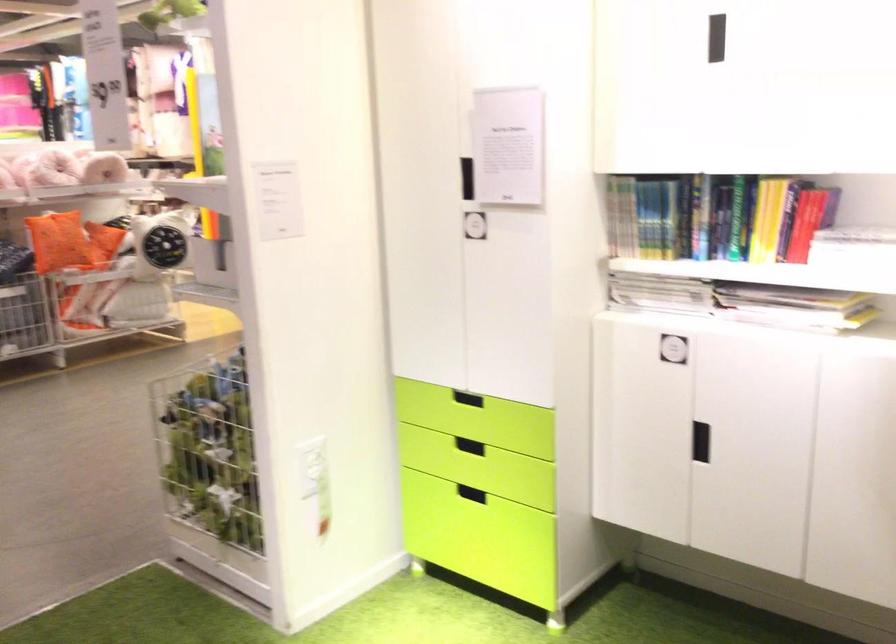
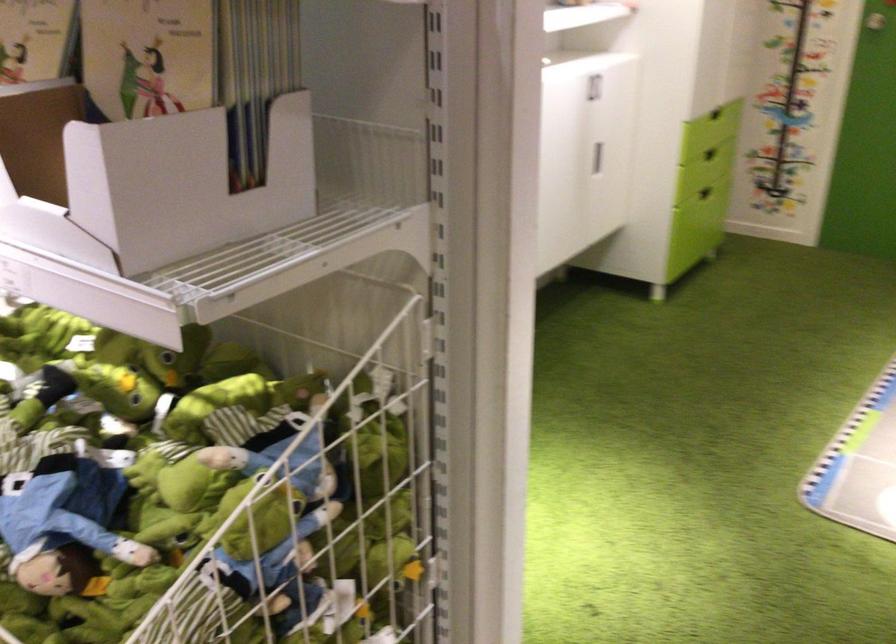
Find the pixel in the second image that matches the point at 271,402 in the first image.

(376, 431)